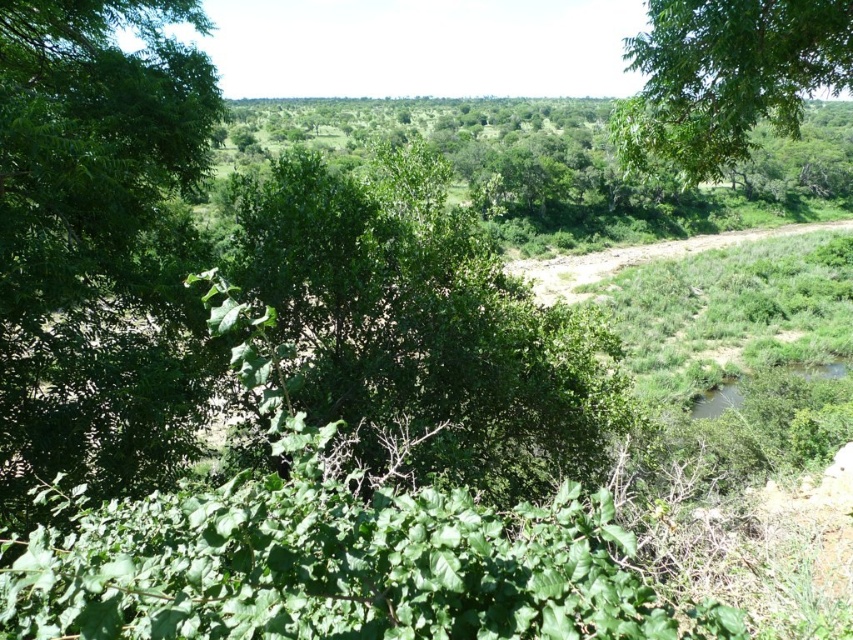
Which of these two, green leafy tree at center or green leafy tree at upper right, stands taller?

green leafy tree at center

This screenshot has height=640, width=853. Identify the location of green leafy tree at center. (424, 326).

Find the location of a particular element. This screenshot has height=640, width=853. green leafy tree at center is located at coordinates (424, 326).